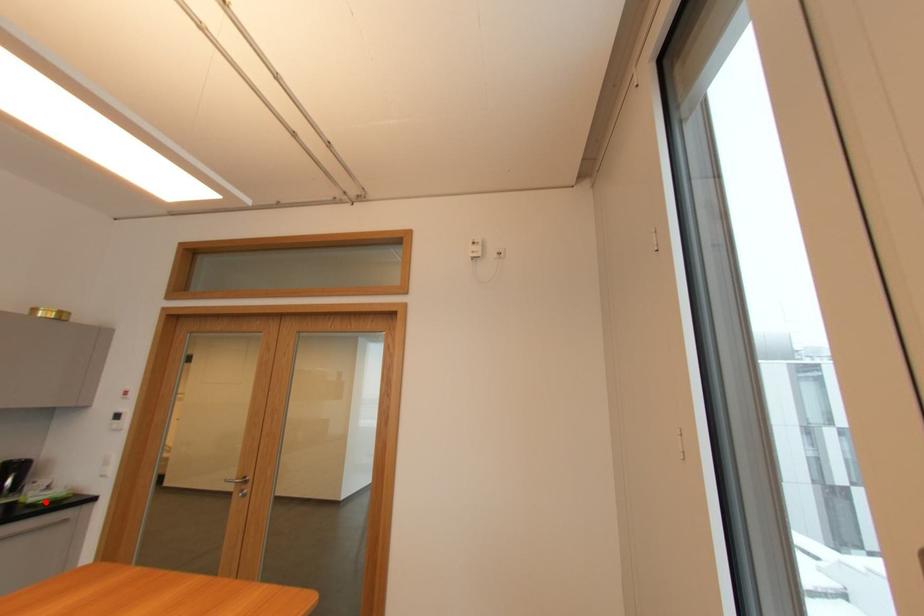
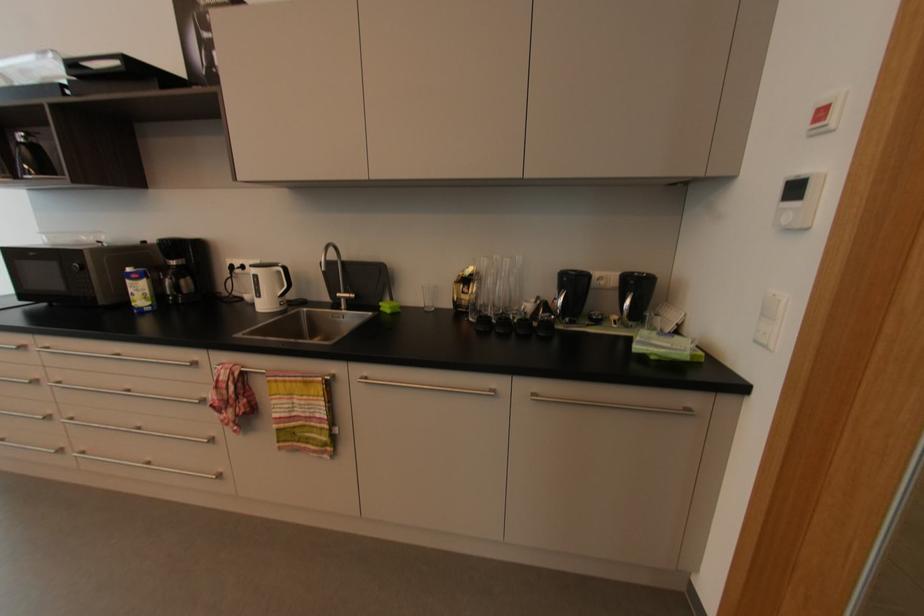
Question: I am providing you with two images of the same scene from different viewpoints. Image1 has a red point marked. In image2, the corresponding 3D location appears at what relative position? Reply with the corresponding letter.

Choices:
 (A) Closer
 (B) Farther

Answer: (B)